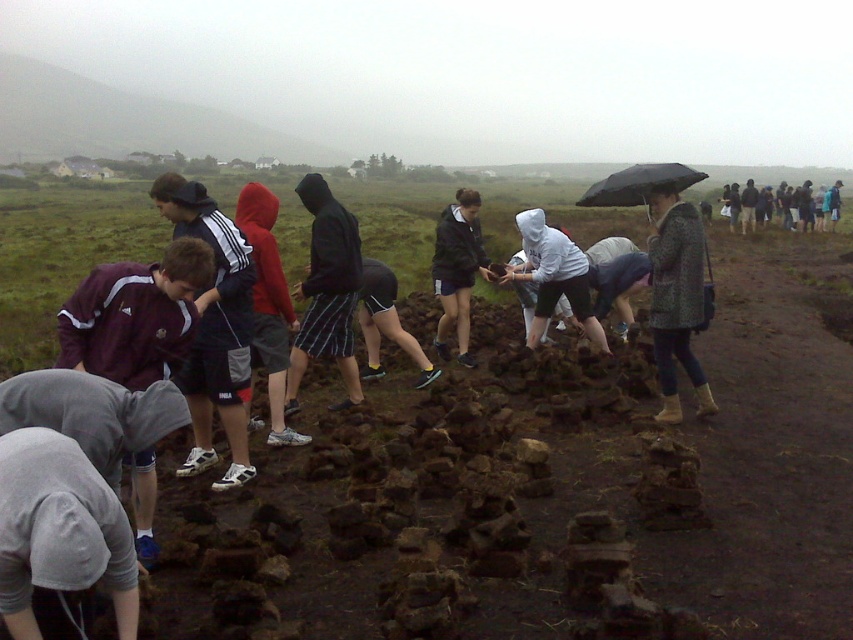
Question: Which object appears closest to the camera in this image?

Choices:
 (A) dark gray fabric shorts at center
 (B) white matte hoodie at center

Answer: (A)

Question: Is damp brown dirt at center further to the viewer compared to maroon jersey at left?

Choices:
 (A) no
 (B) yes

Answer: (A)

Question: Considering the real-world distances, which object is farthest from the gray cotton hoodie at lower left?

Choices:
 (A) white matte hoodie at center
 (B) black hooded sweatshirt at center

Answer: (A)

Question: Is black hooded sweatshirt at center wider than red hoodie at center?

Choices:
 (A) yes
 (B) no

Answer: (B)

Question: Based on their relative distances, which object is farther from the damp brown dirt at center?

Choices:
 (A) black hooded sweatshirt at center
 (B) white matte hoodie at center
 (C) gray hoodie at lower left
 (D) gray cotton hoodie at lower left

Answer: (A)

Question: Can you confirm if black hooded sweatshirt at center is smaller than red hoodie at center?

Choices:
 (A) yes
 (B) no

Answer: (A)